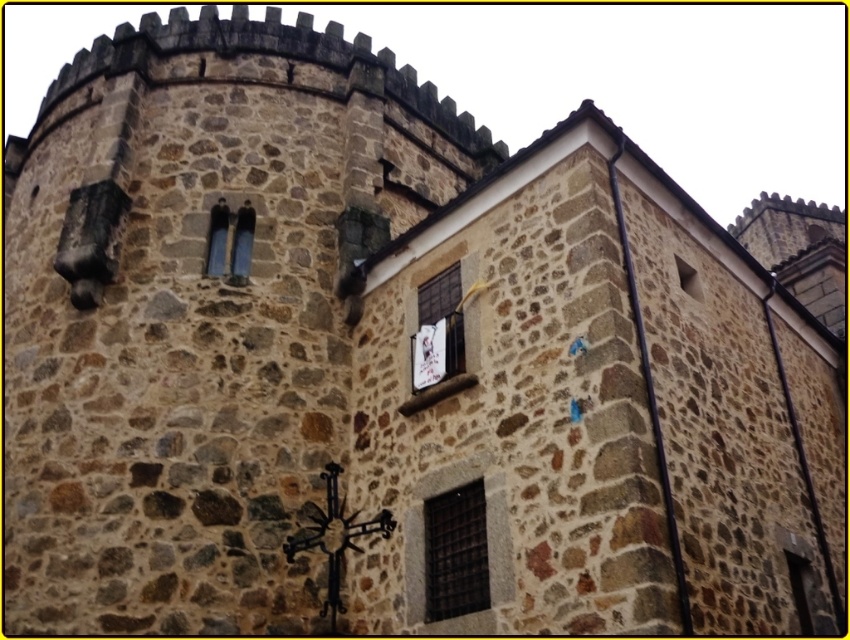
You are an architect reviewing a blueprint of a stone structure. The blueprint has a point marked at coordinate (437, 330). Where is this point located relative to the stone structure?

The point (437, 330) is on white paper at center, so it is located on the blueprint paper at the center, not on the stone structure itself.

You are an architect examining the stone structure and notice the white paper at center and the clear glass window at upper right. Based on their positions, which object is closer to the ground?

The white paper at center is located below the clear glass window at upper right, meaning it is closer to the ground than the window.

You are an architect examining the stone structure. You notice the dark gray metal grid at center and the white paper at center. Which object would require a larger storage container to transport? Please base your answer on their sizes.

The dark gray metal grid at center is bigger than the white paper at center, so it would require a larger storage container for transportation.